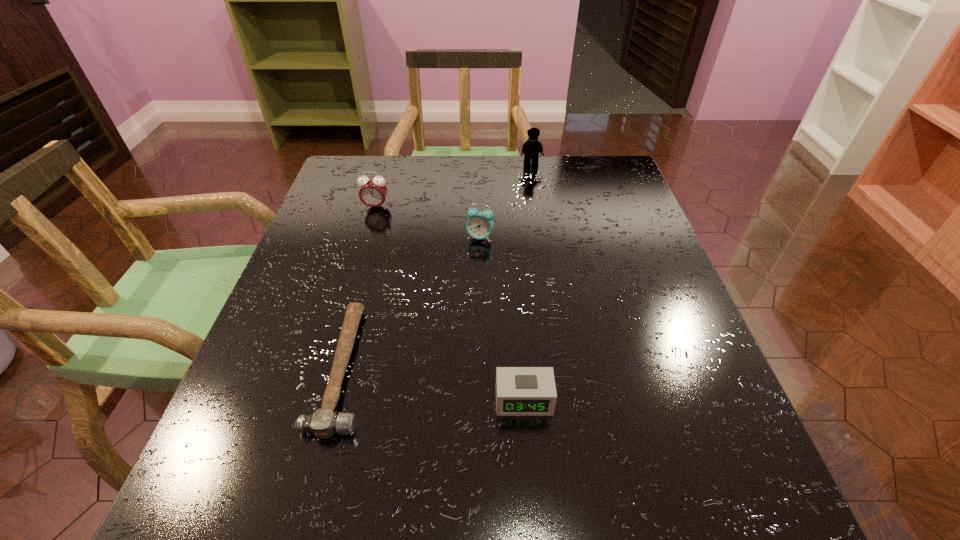
This screenshot has height=540, width=960. I want to click on free location at the right edge of the desktop, so click(653, 271).

Where is `free space at the near right corner of the desktop`? free space at the near right corner of the desktop is located at coordinates (773, 531).

Where is `vacant point located between the farthest alarm clock and the farthest object`? vacant point located between the farthest alarm clock and the farthest object is located at coordinates (453, 186).

At what (x,y) coordinates should I click in order to perform the action: click on free space between the leftmost alarm clock and the hammer. Please return your answer as a coordinate pair (x, y). This screenshot has width=960, height=540. Looking at the image, I should click on (360, 287).

Image resolution: width=960 pixels, height=540 pixels. In order to click on unoccupied area between the third farthest object and the hammer in this screenshot , I will do `click(412, 302)`.

Find the location of a particular element. blank region between the shortest object and the farthest alarm clock is located at coordinates (360, 287).

I want to click on free space between the second farthest alarm clock and the Lego, so click(505, 201).

This screenshot has height=540, width=960. I want to click on blank region between the second farthest alarm clock and the shortest alarm clock, so click(501, 319).

Identify the location of unoccupied area between the second farthest object and the Lego. This screenshot has width=960, height=540. (453, 186).

Find the location of a particular element. free space between the fourth tallest object and the second farthest object is located at coordinates (449, 303).